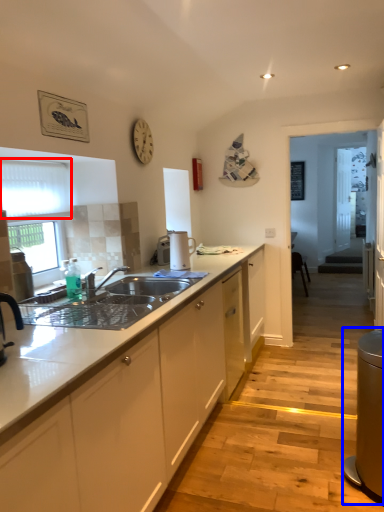
Question: Which object appears closest to the camera in this image, window screen (highlighted by a red box) or appliance (highlighted by a blue box)?

Choices:
 (A) window screen
 (B) appliance

Answer: (B)